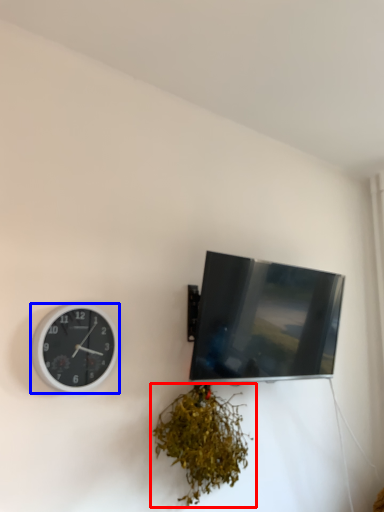
Question: Among these objects, which one is nearest to the camera, houseplant (highlighted by a red box) or wall clock (highlighted by a blue box)?

Choices:
 (A) houseplant
 (B) wall clock

Answer: (B)